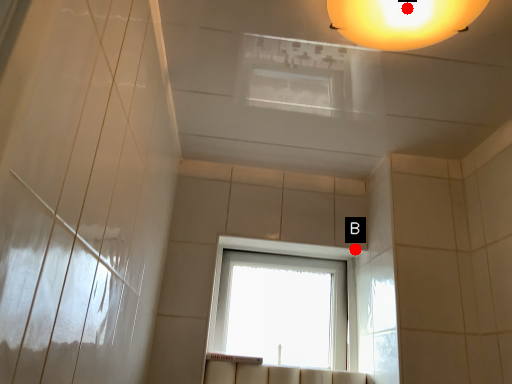
Question: Two points are circled on the image, labeled by A and B beside each circle. Which point is farther to the camera?

Choices:
 (A) A is further
 (B) B is further

Answer: (B)